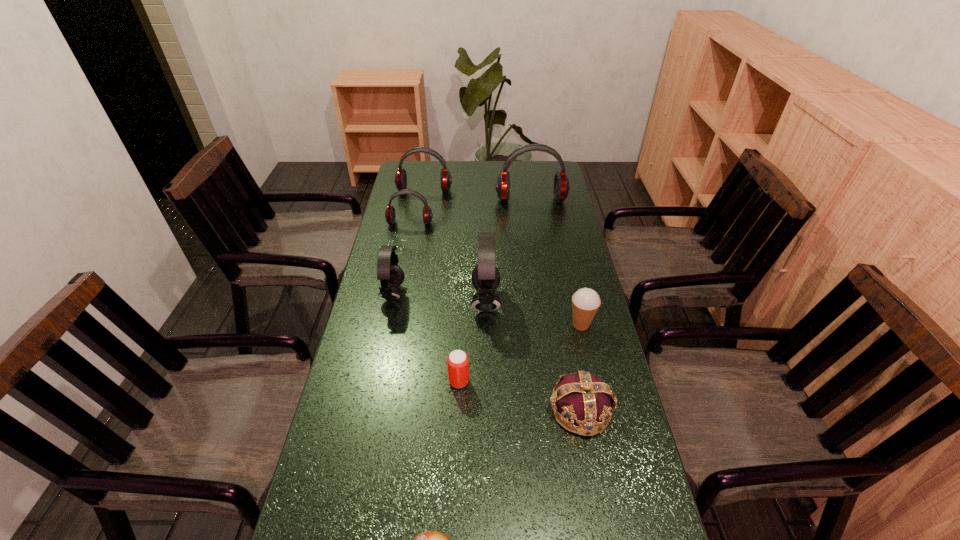
The height and width of the screenshot is (540, 960). Identify the location of the biggest red earphone. (561, 181).

You are a GUI agent. You are given a task and a screenshot of the screen. Output one action in this format:
    pyautogui.click(x=<x>, y=<y>)
    Task: Click on the right black earphone
    This screenshot has height=540, width=960.
    Given the screenshot: What is the action you would take?
    pyautogui.click(x=485, y=277)

Locate an element on the screen. Image resolution: width=960 pixels, height=540 pixels. the second smallest red earphone is located at coordinates (400, 179).

You are a GUI agent. You are given a task and a screenshot of the screen. Output one action in this format:
    pyautogui.click(x=<x>, y=<y>)
    Task: Click on the left black earphone
    This screenshot has height=540, width=960.
    Given the screenshot: What is the action you would take?
    pyautogui.click(x=389, y=273)

Where is `the nearest red earphone`? the nearest red earphone is located at coordinates (390, 215).

Locate an element on the screen. The height and width of the screenshot is (540, 960). the smallest red earphone is located at coordinates (390, 215).

Where is `icecream`? icecream is located at coordinates (585, 302).

The image size is (960, 540). What are the coordinates of `purple crown` in the screenshot? It's located at (583, 398).

What are the coordinates of `beer can` in the screenshot? It's located at (457, 361).

You are a GUI agent. You are given a task and a screenshot of the screen. Output one action in this format:
    pyautogui.click(x=<x>, y=<y>)
    Task: Click on the vacant space located on the ear cups of the biggest red earphone
    The height and width of the screenshot is (540, 960).
    Given the screenshot: What is the action you would take?
    coord(539,244)